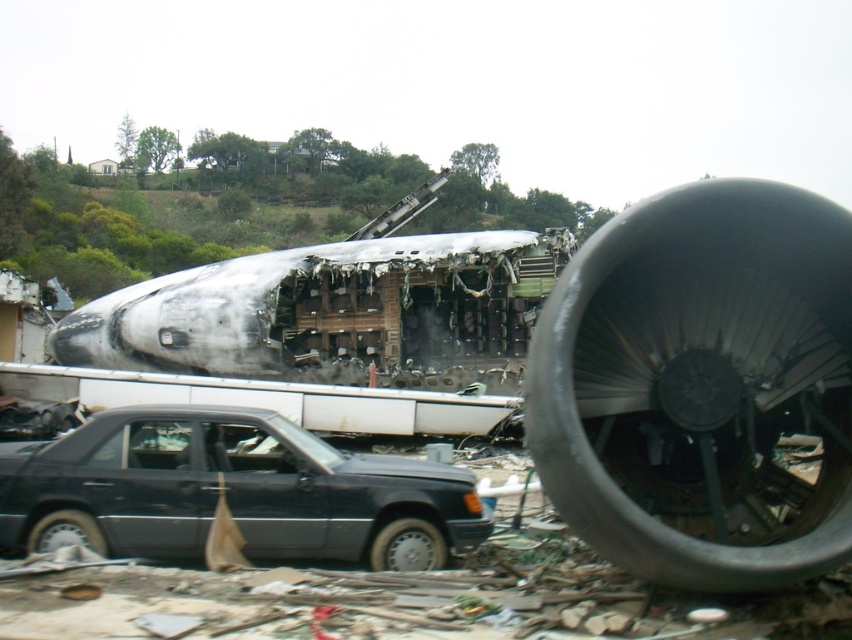
Looking at this image, which of these two, matte black sedan at lower left or silver metallic tire at lower center, stands shorter?

silver metallic tire at lower center is shorter.

Which is behind, point (96, 476) or point (417, 547)?

Positioned behind is point (417, 547).

The image size is (852, 640). In order to click on matte black sedan at lower left in this screenshot , I will do `click(231, 492)`.

Is point (430, 540) positioned in front of point (35, 538)?

That is False.

You are a GUI agent. You are given a task and a screenshot of the screen. Output one action in this format:
    pyautogui.click(x=<x>, y=<y>)
    Task: Click on the silver metallic tire at lower center
    
    Given the screenshot: What is the action you would take?
    pyautogui.click(x=407, y=547)

Identify the location of silver metallic tire at lower center. This screenshot has height=640, width=852. (407, 547).

Is matte black sedan at lower left positioned before black rubber tire at lower left?

Yes, it is in front of black rubber tire at lower left.

Does matte black sedan at lower left appear on the left side of black rubber tire at lower left?

Incorrect, matte black sedan at lower left is not on the left side of black rubber tire at lower left.

This screenshot has height=640, width=852. Describe the element at coordinates (231, 492) in the screenshot. I see `matte black sedan at lower left` at that location.

What are the coordinates of `matte black sedan at lower left` in the screenshot? It's located at (231, 492).